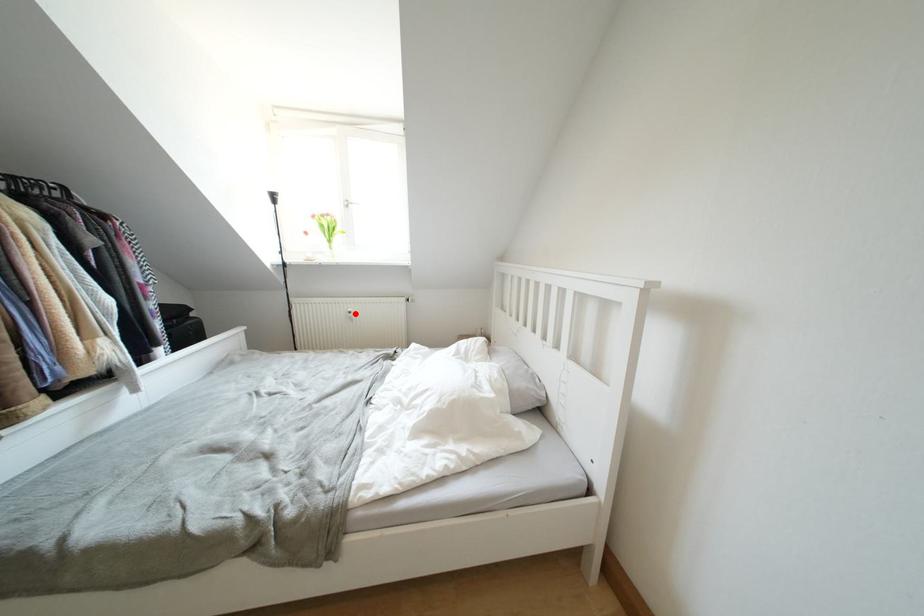
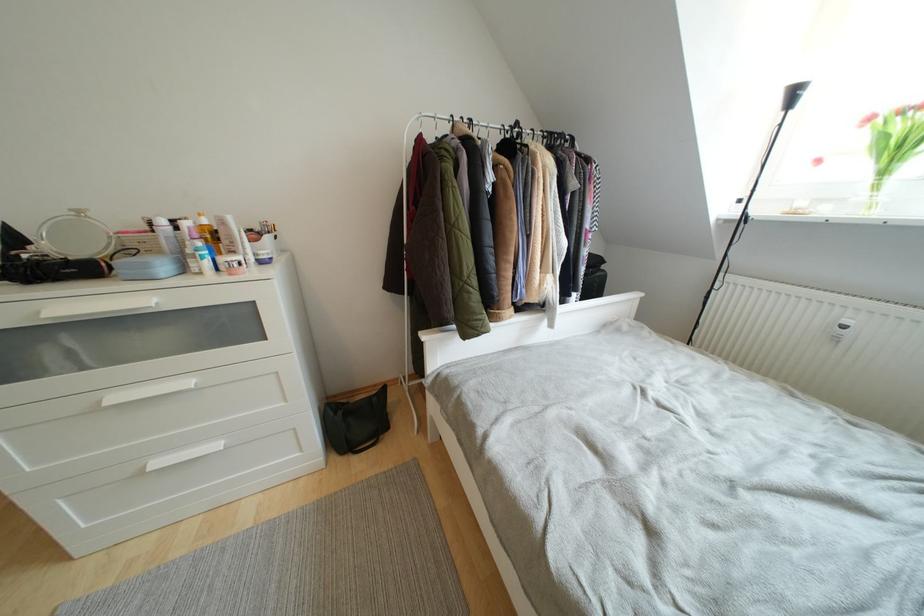
In the second image, find the point that corresponds to the highlighted location in the first image.

(853, 326)